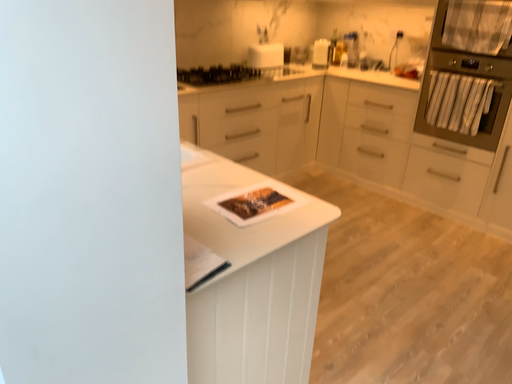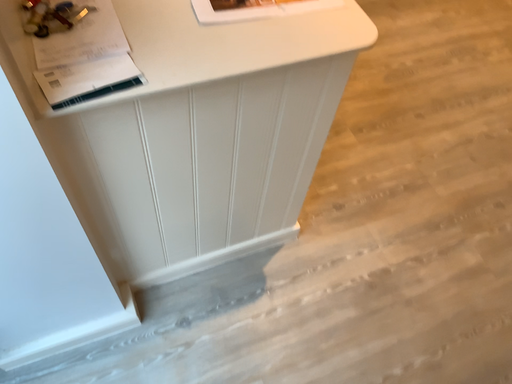
Question: How did the camera likely rotate when shooting the video?

Choices:
 (A) rotated upward
 (B) rotated downward

Answer: (B)